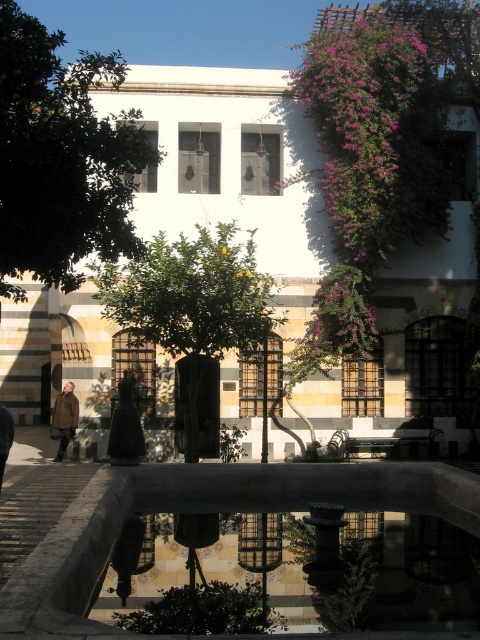
Between brown woolen coat at lower left and brown leather jacket at lower left, which one is positioned higher?

brown leather jacket at lower left

Who is lower down, brown woolen coat at lower left or brown leather jacket at lower left?

brown woolen coat at lower left is below.

Locate an element on the screen. This screenshot has width=480, height=640. brown woolen coat at lower left is located at coordinates (64, 417).

Is point (13, 289) closer to viewer compared to point (218, 394)?

Yes, point (13, 289) is closer to viewer.

Does green leafy tree at upper left have a lesser height compared to green leafy tree at center?

In fact, green leafy tree at upper left may be taller than green leafy tree at center.

Find the location of a particular element. This screenshot has height=640, width=480. green leafy tree at upper left is located at coordinates (60, 157).

Can you confirm if green leafy tree at center is smaller than brown woolen coat at lower left?

Actually, green leafy tree at center might be larger than brown woolen coat at lower left.

Is green leafy tree at center closer to the viewer compared to brown woolen coat at lower left?

Yes.

Where is `green leafy tree at center`? green leafy tree at center is located at coordinates (192, 310).